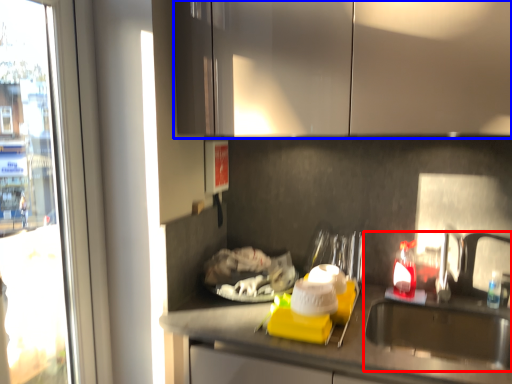
Question: Which of the following is the closest to the observer, sink (highlighted by a red box) or cabinetry (highlighted by a blue box)?

Choices:
 (A) sink
 (B) cabinetry

Answer: (B)